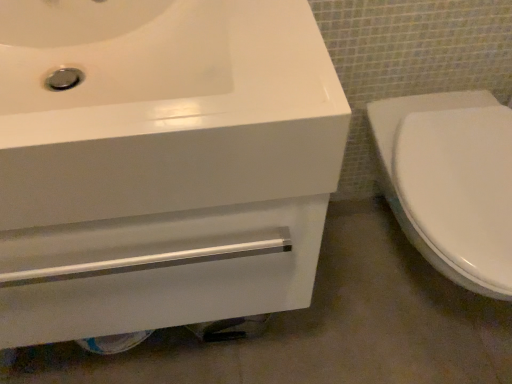
Where is `free point above white glossy toilet at right (from a real-world perspective)`? free point above white glossy toilet at right (from a real-world perspective) is located at coordinates (461, 156).